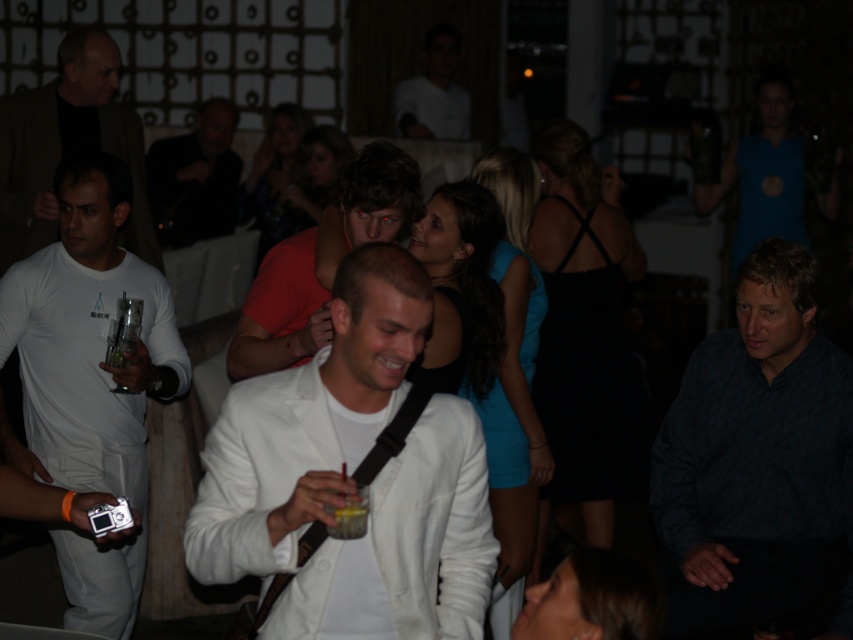
Is point (239, 163) positioned before point (404, 104)?

Yes, point (239, 163) is in front of point (404, 104).

Who is more forward, (177, 237) or (444, 120)?

Positioned in front is point (177, 237).

Find the location of `dark brown leather jacket at upper center`. dark brown leather jacket at upper center is located at coordinates (195, 177).

Is white matte t-shirt at left shorter than matte red shirt at center?

Incorrect, white matte t-shirt at left's height does not fall short of matte red shirt at center's.

Where is `white matte t-shirt at left`? This screenshot has width=853, height=640. white matte t-shirt at left is located at coordinates (86, 340).

Which is behind, point (86, 264) or point (318, 305)?

The point (86, 264) is behind.

The height and width of the screenshot is (640, 853). What are the coordinates of `white matte t-shirt at left` in the screenshot? It's located at (86, 340).

Between point (44, 163) and point (431, 35), which one is positioned behind?

Positioned behind is point (431, 35).

The height and width of the screenshot is (640, 853). What do you see at coordinates (68, 145) in the screenshot? I see `white matte shirt at left` at bounding box center [68, 145].

Describe the element at coordinates (68, 145) in the screenshot. I see `white matte shirt at left` at that location.

I want to click on white matte shirt at left, so click(x=68, y=145).